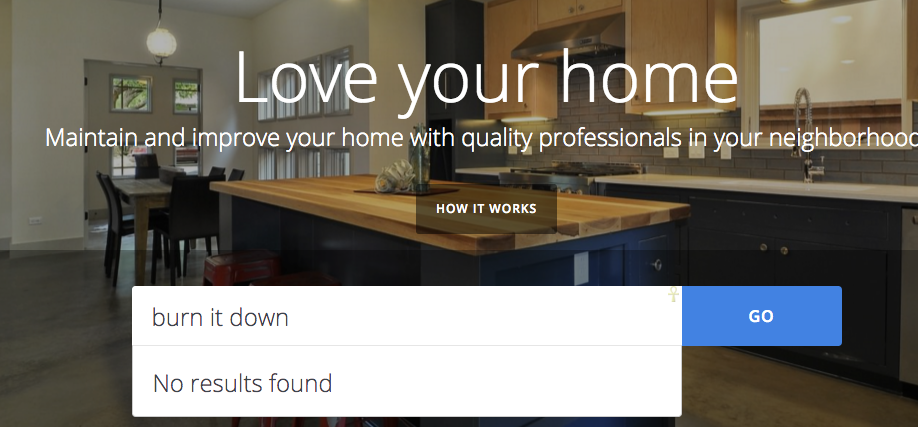
This screenshot has height=427, width=918. Find the location of `kitchen range`. kitchen range is located at coordinates (567, 176).